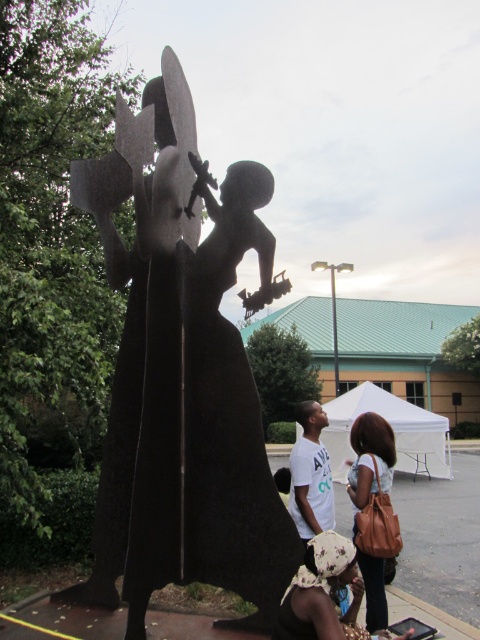
Question: Considering the real-world distances, which object is closest to the white matte shirt at center?

Choices:
 (A) black matte sculpture at center
 (B) matte brown purse at lower center
 (C) brown leather purse at lower center

Answer: (C)

Question: Is black matte sculpture at center further to camera compared to matte brown purse at lower center?

Choices:
 (A) yes
 (B) no

Answer: (A)

Question: In this image, where is brown leather purse at lower center located relative to white matte shirt at center?

Choices:
 (A) above
 (B) below

Answer: (B)

Question: Among these points, which one is farthest from the camera?

Choices:
 (A) (x=367, y=452)
 (B) (x=167, y=237)
 (C) (x=295, y=518)
 (D) (x=332, y=540)

Answer: (C)

Question: Does brown leather purse at lower center have a larger size compared to white matte shirt at center?

Choices:
 (A) no
 (B) yes

Answer: (B)

Question: Estimate the real-world distances between objects in this image. Which object is farther from the white matte shirt at center?

Choices:
 (A) brown leather purse at lower center
 (B) matte brown purse at lower center
 (C) black matte sculpture at center

Answer: (C)